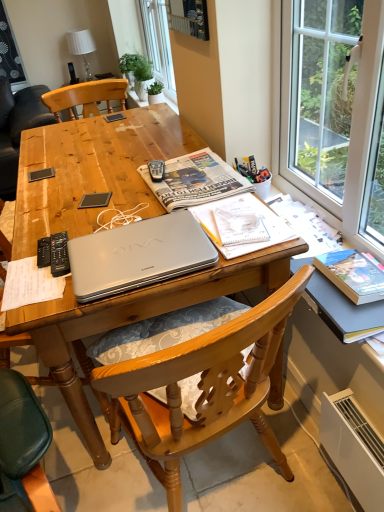
Image resolution: width=384 pixels, height=512 pixels. I want to click on vacant location behind black plastic remote control at left, positioned as the 2th remote control in left-to-right order, so click(66, 219).